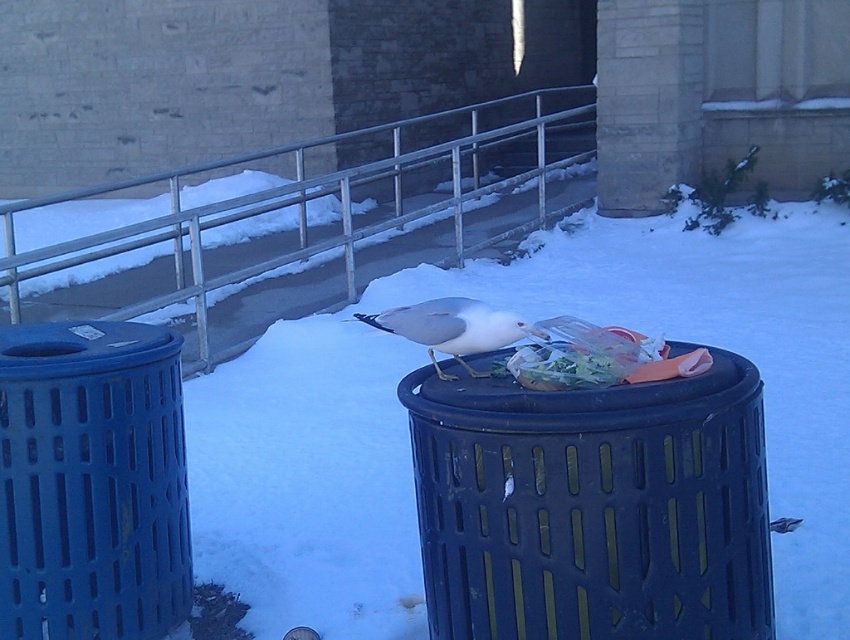
Question: Which object appears closest to the camera in this image?

Choices:
 (A) brushed metal rail at center
 (B) white powder snow at center
 (C) matte black trash can at center
 (D) white matte bird at center

Answer: (C)

Question: From the image, what is the correct spatial relationship of white powder snow at center in relation to translucent plastic bag at center?

Choices:
 (A) right
 (B) left

Answer: (A)

Question: Is white powder snow at center closer to the viewer compared to blue plastic trash can at left?

Choices:
 (A) yes
 (B) no

Answer: (B)

Question: Which of the following is the farthest from the observer?

Choices:
 (A) white matte bird at center
 (B) translucent plastic bag at center
 (C) brushed metal rail at center

Answer: (C)

Question: Which point is farther to the camera?

Choices:
 (A) translucent plastic bag at center
 (B) blue plastic trash can at left

Answer: (B)

Question: Observing the image, what is the correct spatial positioning of blue plastic trash can at left in reference to brushed metal rail at center?

Choices:
 (A) right
 (B) left

Answer: (B)